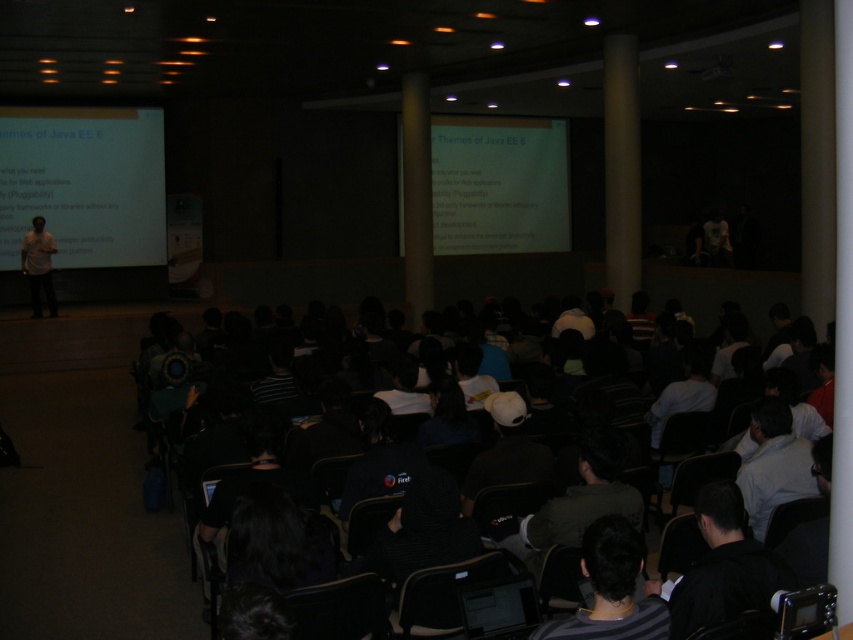
In the conference room scene, you see a white matte projector screen at upper left and a black fabric shirt at lower right. Which object is taller?

The white matte projector screen at upper left is much taller than the black fabric shirt at lower right.

You are an attendee at the conference and want to take a photo of the presenter wearing the black fabric shirt at center. However, there is someone in the way with the light brown shirt at left. Can you move to the right to get a clear shot?

The black fabric shirt at center is positioned under the light brown shirt at left, so moving to the right might still block the view unless you move far enough to the side to position yourself below the light brown shirt at left.

You are an attendee sitting in the front row of the conference room. You want to take a photo of the white matte projector screen at upper left with your phone. Considering the distance, will the screen be in focus if your phone camera has a maximum focus range of 45 feet?

The white matte projector screen at upper left is 47.52 feet away from the viewer. Since the phone camera can only focus up to 45 feet, the screen will be out of focus.